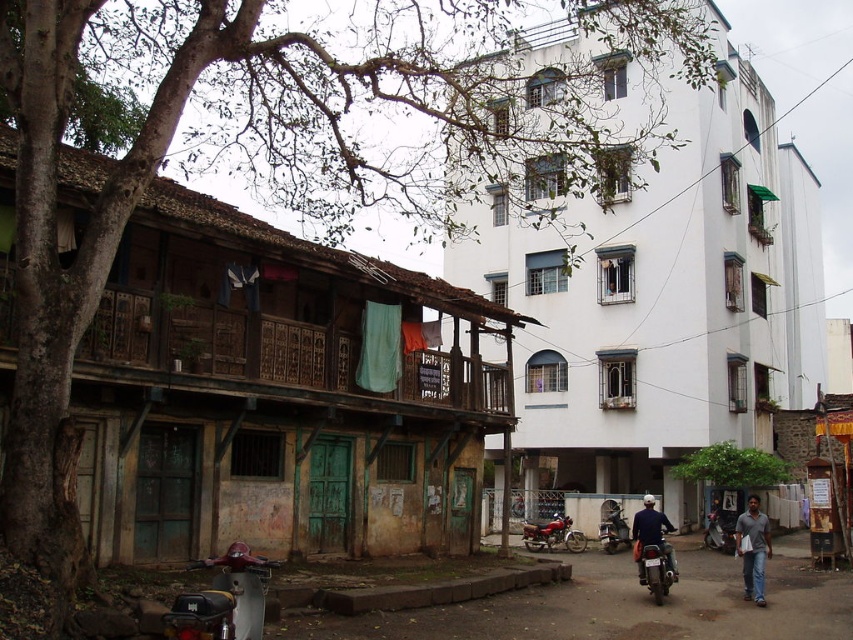
Between shiny red motorcycle at center and metallic silver motorcycle at center, which one has more height?

With more height is metallic silver motorcycle at center.

Is point (579, 536) closer to camera compared to point (614, 518)?

No, (579, 536) is further to viewer.

Is point (556, 536) in front of point (611, 538)?

That is False.

This screenshot has width=853, height=640. Find the location of `shiny red motorcycle at center`. shiny red motorcycle at center is located at coordinates (552, 534).

Between shiny metallic motorcycle at lower right and dark blue shirt at center, which one has less height?

With less height is shiny metallic motorcycle at lower right.

Between point (640, 548) and point (665, 515), which one is positioned behind?

Positioned behind is point (665, 515).

This screenshot has width=853, height=640. Find the location of `shiny metallic motorcycle at lower right`. shiny metallic motorcycle at lower right is located at coordinates (654, 566).

This screenshot has width=853, height=640. What do you see at coordinates (752, 548) in the screenshot? I see `dark gray cotton shirt at lower right` at bounding box center [752, 548].

In order to click on dark gray cotton shirt at lower right in this screenshot , I will do `click(752, 548)`.

Is point (744, 564) positioned behind point (529, 532)?

No.

At what (x,y) coordinates should I click in order to perform the action: click on dark gray cotton shirt at lower right. Please return your answer as a coordinate pair (x, y). This screenshot has width=853, height=640. Looking at the image, I should click on tap(752, 548).